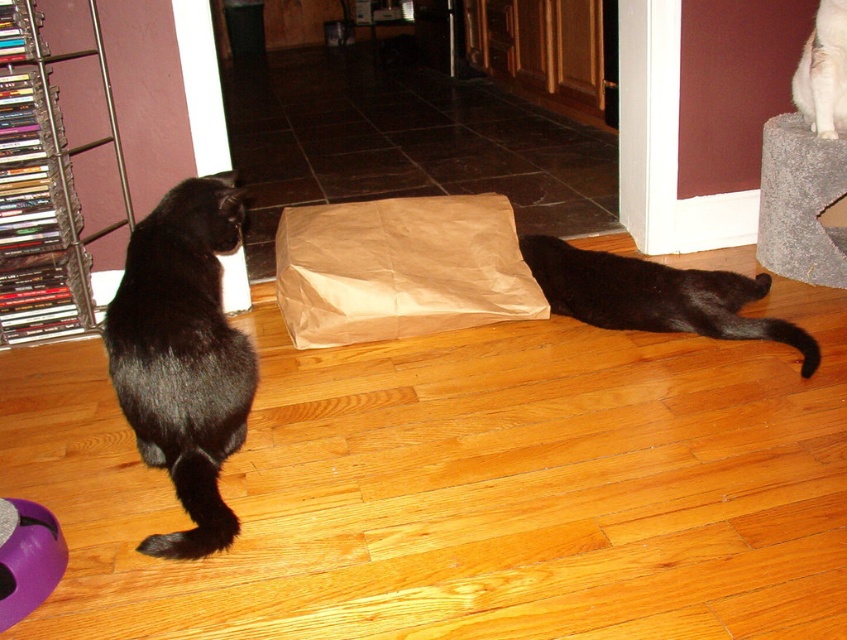
Question: Is black matte fur cat at lower right to the left of white fluffy cat at upper right from the viewer's perspective?

Choices:
 (A) no
 (B) yes

Answer: (B)

Question: Where is brown paper bag at center located in relation to black matte fur cat at lower right in the image?

Choices:
 (A) below
 (B) above

Answer: (B)

Question: Among these objects, which one is nearest to the camera?

Choices:
 (A) black fur cat at left
 (B) white fluffy cat at upper right
 (C) black matte fur cat at lower right

Answer: (A)

Question: Which object is farther from the camera taking this photo?

Choices:
 (A) white fluffy cat at upper right
 (B) black fur cat at left
 (C) black matte fur cat at lower right

Answer: (A)

Question: Is black matte fur cat at lower right smaller than white fluffy cat at upper right?

Choices:
 (A) no
 (B) yes

Answer: (A)

Question: Which of the following is the closest to the observer?

Choices:
 (A) (142, 408)
 (B) (457, 252)
 (C) (831, 8)
 (D) (734, 276)

Answer: (A)